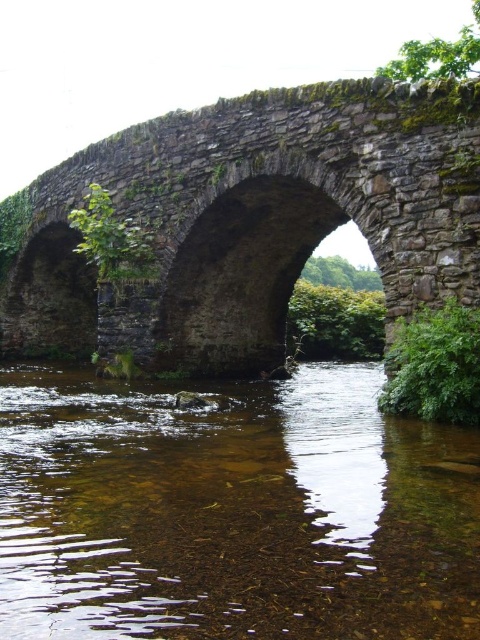
Measure the distance between clear water at center and rusty stone bridge at center.

clear water at center and rusty stone bridge at center are 26.70 meters apart from each other.

Who is higher up, clear water at center or rusty stone bridge at center?

Positioned higher is rusty stone bridge at center.

I want to click on clear water at center, so click(x=232, y=513).